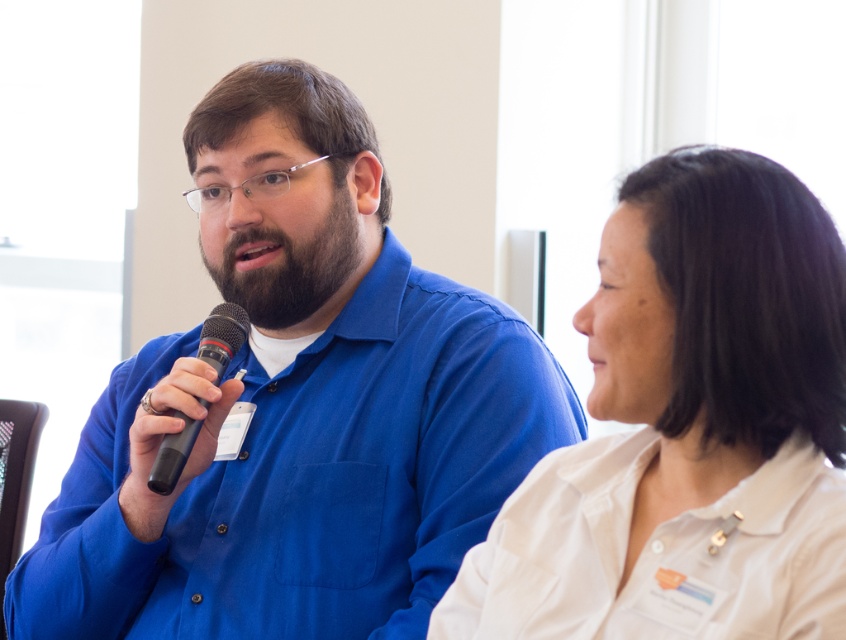
Is dark brown beard at center wider than black rubber microphone at left?

Indeed, dark brown beard at center has a greater width compared to black rubber microphone at left.

In the scene shown: Is dark brown beard at center below black rubber microphone at left?

No, dark brown beard at center is not below black rubber microphone at left.

Who is more distant from viewer, [215,280] or [155,461]?

The point [215,280] is behind.

Identify the location of dark brown beard at center. The height and width of the screenshot is (640, 846). (290, 268).

Is white matte shirt at upper right thinner than dark brown beard at center?

Incorrect, white matte shirt at upper right's width is not less than dark brown beard at center's.

Can you confirm if white matte shirt at upper right is taller than dark brown beard at center?

Correct, white matte shirt at upper right is much taller as dark brown beard at center.

Is point (663, 429) closer to camera compared to point (339, 228)?

Yes, point (663, 429) is closer to viewer.

Locate an element on the screen. The width and height of the screenshot is (846, 640). white matte shirt at upper right is located at coordinates (689, 428).

Between point (80, 596) and point (735, 480), which one is positioned in front?

Positioned in front is point (735, 480).

Between matte blue shirt at center and white matte shirt at upper right, which one appears on the left side from the viewer's perspective?

From the viewer's perspective, matte blue shirt at center appears more on the left side.

Does point (345, 266) lie behind point (783, 323)?

That is True.

Find the location of `matte blue shirt at center`. matte blue shirt at center is located at coordinates (295, 406).